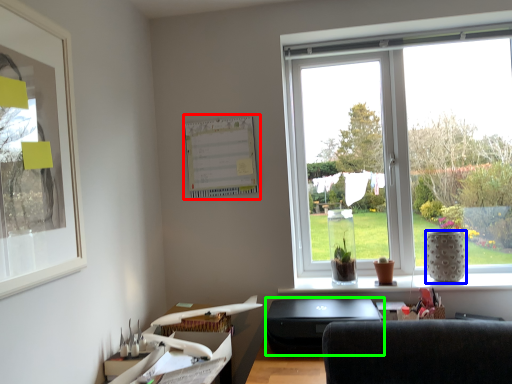
Question: Which object is positioned farthest from bulletin board (highlighted by a red box)? Select from vase (highlighted by a blue box) and desktop (highlighted by a green box).

Choices:
 (A) vase
 (B) desktop

Answer: (A)